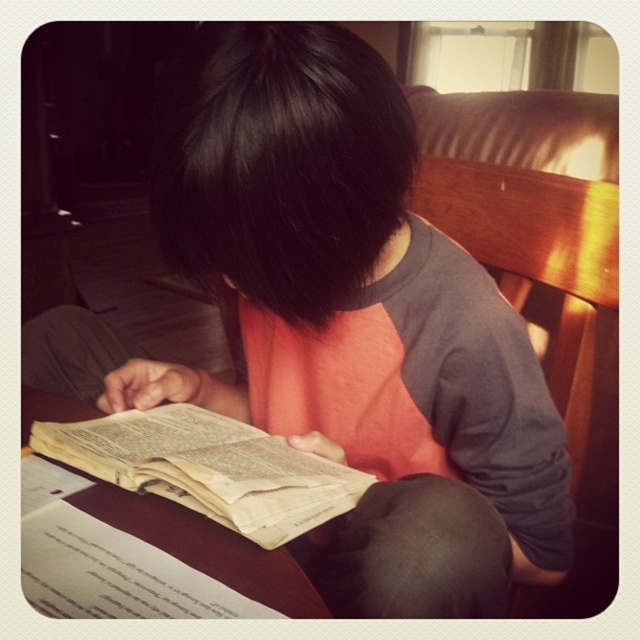
You are organizing a bookshelf and need to place the yellowish paper book at center and the black fabric at lower center. Which object should you place first if you want to arrange them from smallest to largest?

You should place the yellowish paper book at center first since it is smaller than the black fabric at lower center, following the smallest to largest arrangement.

You are a librarian trying to place the yellowish paper book at center and the black fabric at lower center on a shelf. The shelf has a height limit of 10 cm. Can both items fit vertically without exceeding the height limit?

The yellowish paper book at center is shorter than black fabric at lower center. Since the shelf has a height limit of 10 cm, both items can fit vertically as long as the tallest item, which is the black fabric at lower center, is under 10 cm in height.